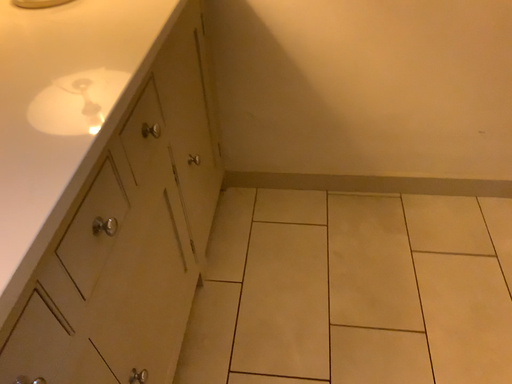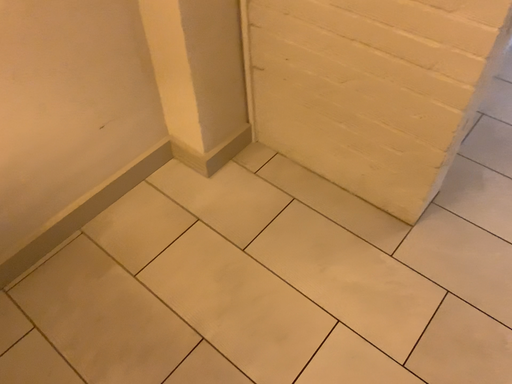
Question: Which way did the camera rotate in the video?

Choices:
 (A) rotated upward
 (B) rotated downward

Answer: (A)